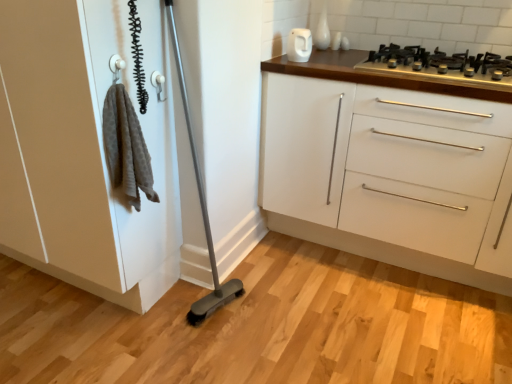
This screenshot has height=384, width=512. I want to click on vacant space in front of white glossy electric kettle at upper center, so pyautogui.click(x=308, y=71).